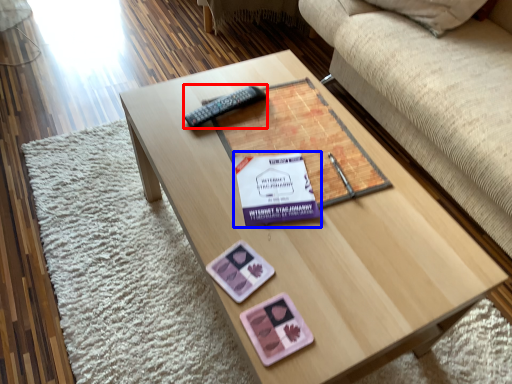
Question: Which of the following is the closest to the observer, remote (highlighted by a red box) or paperback book (highlighted by a blue box)?

Choices:
 (A) remote
 (B) paperback book

Answer: (B)